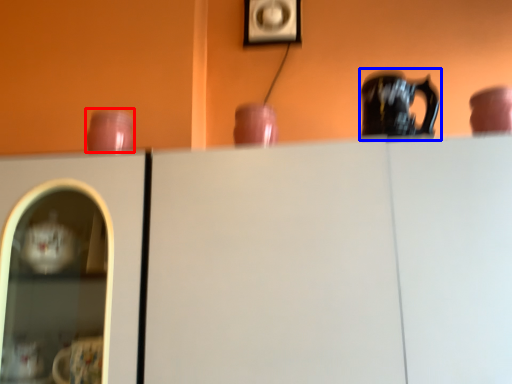
Question: Which object is further to the camera taking this photo, tableware (highlighted by a red box) or jug (highlighted by a blue box)?

Choices:
 (A) tableware
 (B) jug

Answer: (A)